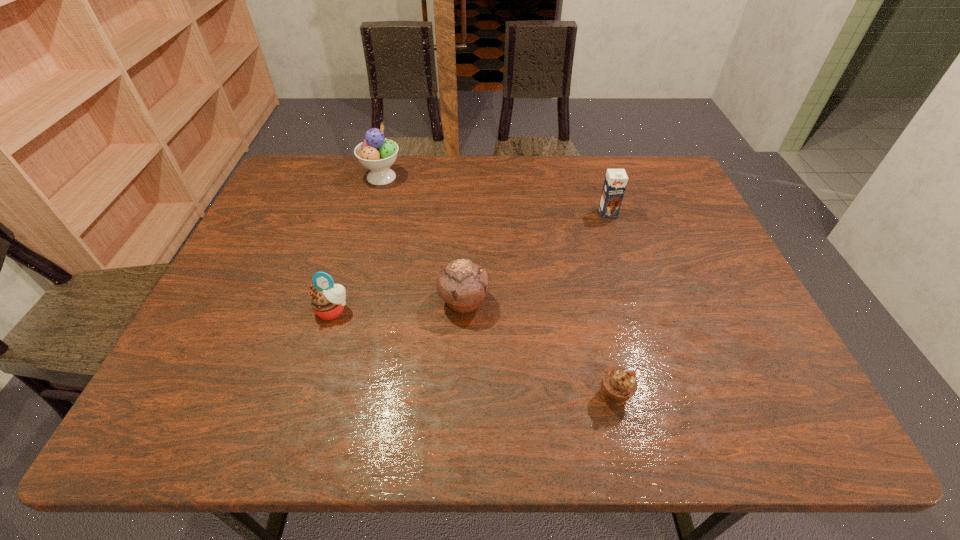
Find the location of a particular element. free space located 0.220m on the front-facing side of the leftmost muffin is located at coordinates (301, 416).

Find the location of a particular element. The height and width of the screenshot is (540, 960). vacant position located on the right of the nearest object is located at coordinates (751, 395).

What are the coordinates of `object that is at the far edge` in the screenshot? It's located at (376, 153).

In order to click on object present at the near edge in this screenshot , I will do pyautogui.click(x=618, y=384).

Where is `free space at the far edge of the desktop`? The image size is (960, 540). free space at the far edge of the desktop is located at coordinates (423, 185).

Find the location of a particular element. The height and width of the screenshot is (540, 960). vacant space at the near edge of the desktop is located at coordinates (602, 400).

Find the location of a particular element. The image size is (960, 540). free space at the left edge of the desktop is located at coordinates (283, 212).

The height and width of the screenshot is (540, 960). In the image, there is a desktop. Identify the location of vacant region at the right edge. (712, 361).

The height and width of the screenshot is (540, 960). I want to click on vacant position at the far left corner of the desktop, so click(324, 186).

I want to click on blank area at the far right corner, so click(665, 186).